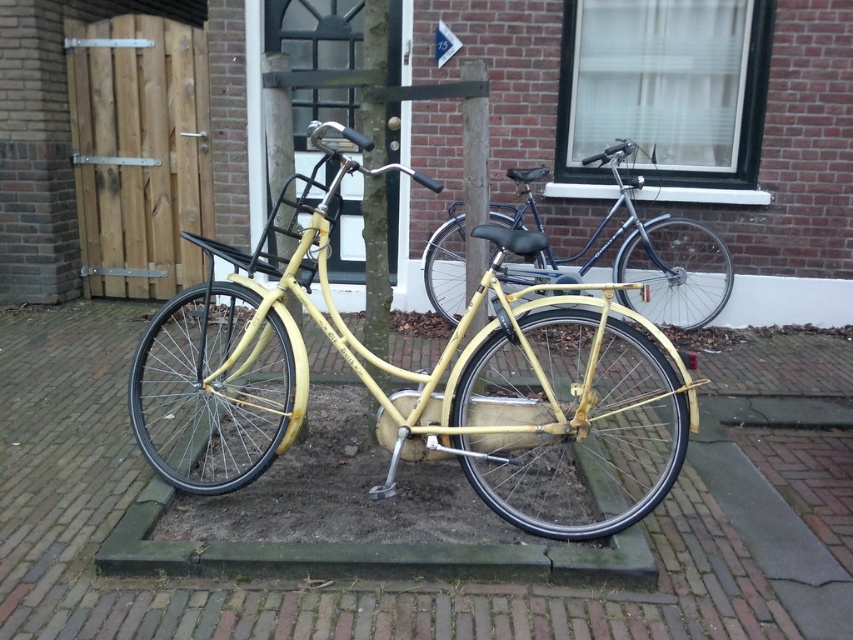
Is point (125, 179) positioned before point (425, 275)?

No, (125, 179) is further to viewer.

Which of these two, wooden gate at left or matte blue bicycle at center, stands shorter?

matte blue bicycle at center

The height and width of the screenshot is (640, 853). I want to click on wooden gate at left, so click(138, 152).

The height and width of the screenshot is (640, 853). I want to click on wooden gate at left, so click(x=138, y=152).

Which of these two, yellow matte bicycle at center or wooden gate at left, stands taller?

With more height is wooden gate at left.

In the scene shown: Measure the distance between point (140, 346) and camera.

Point (140, 346) and camera are 2.03 meters apart.

This screenshot has width=853, height=640. I want to click on yellow matte bicycle at center, so click(413, 381).

Between point (445, 358) and point (438, 240), which one is positioned in front?

Point (445, 358) is in front.

Is yellow matte bicycle at center thinner than matte blue bicycle at center?

Incorrect, yellow matte bicycle at center's width is not less than matte blue bicycle at center's.

Who is more forward, [590,310] or [647,230]?

Point [590,310]

Locate an element on the screen. yellow matte bicycle at center is located at coordinates (413, 381).